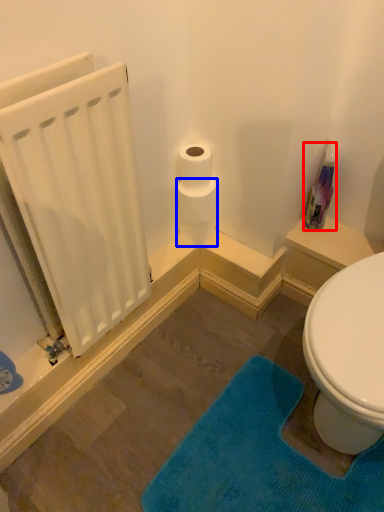
Question: Which object is further to the camera taking this photo, cleaning product (highlighted by a red box) or toilet paper (highlighted by a blue box)?

Choices:
 (A) cleaning product
 (B) toilet paper

Answer: (B)